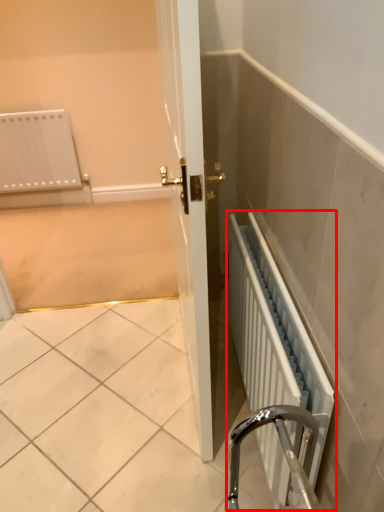
Question: Observing the image, what is the correct spatial positioning of radiator (annotated by the red box) in reference to screen door?

Choices:
 (A) left
 (B) right

Answer: (B)